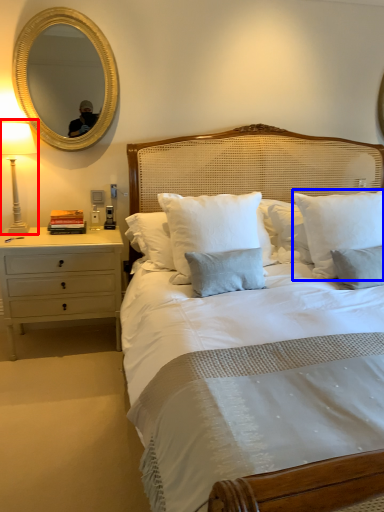
Question: Which object is further to the camera taking this photo, bedside lamp (highlighted by a red box) or pillow (highlighted by a blue box)?

Choices:
 (A) bedside lamp
 (B) pillow

Answer: (A)